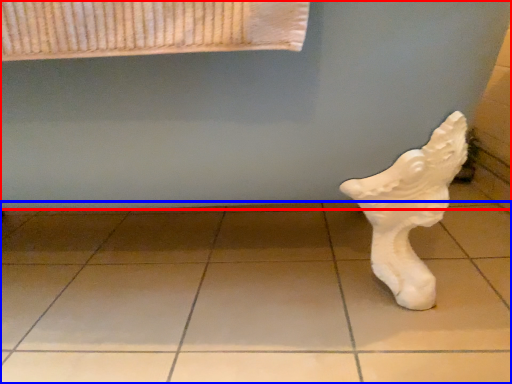
Question: Which of the following is the closest to the observer, bath (highlighted by a red box) or tile (highlighted by a blue box)?

Choices:
 (A) bath
 (B) tile

Answer: (A)